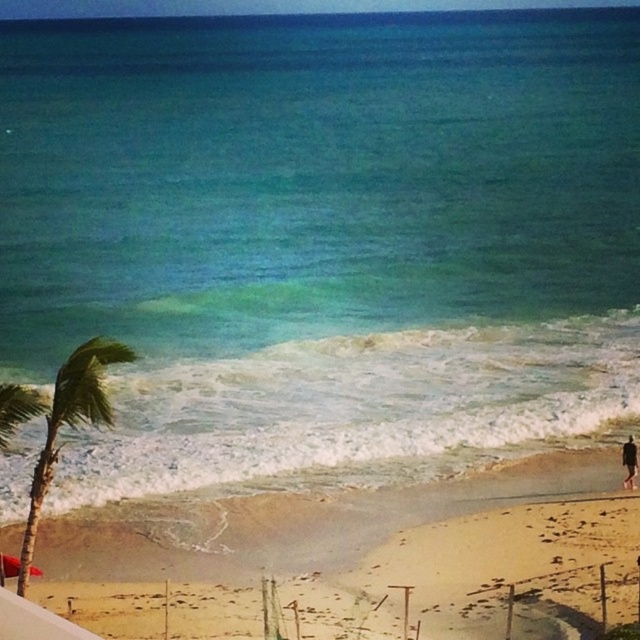
Does sandy beach at lower center appear over green leafy palm tree at left?

Actually, sandy beach at lower center is below green leafy palm tree at left.

Who is positioned more to the left, sandy beach at lower center or green leafy palm tree at left?

Positioned to the left is green leafy palm tree at left.

Locate an element on the screen. sandy beach at lower center is located at coordinates (364, 557).

Can you confirm if sandy beach at lower center is shorter than black fabric person at lower right?

No, sandy beach at lower center is not shorter than black fabric person at lower right.

Is sandy beach at lower center below black fabric person at lower right?

Correct, sandy beach at lower center is located below black fabric person at lower right.

Image resolution: width=640 pixels, height=640 pixels. In order to click on sandy beach at lower center in this screenshot , I will do `click(364, 557)`.

Does green leafy palm tree at left appear on the left side of black fabric person at lower right?

Yes, green leafy palm tree at left is to the left of black fabric person at lower right.

Can you confirm if green leafy palm tree at left is taller than black fabric person at lower right?

Correct, green leafy palm tree at left is much taller as black fabric person at lower right.

Is point (4, 422) closer to viewer compared to point (634, 452)?

Yes, it is.

At what (x,y) coordinates should I click in order to perform the action: click on green leafy palm tree at left. Please return your answer as a coordinate pair (x, y). The image size is (640, 640). Looking at the image, I should click on (60, 419).